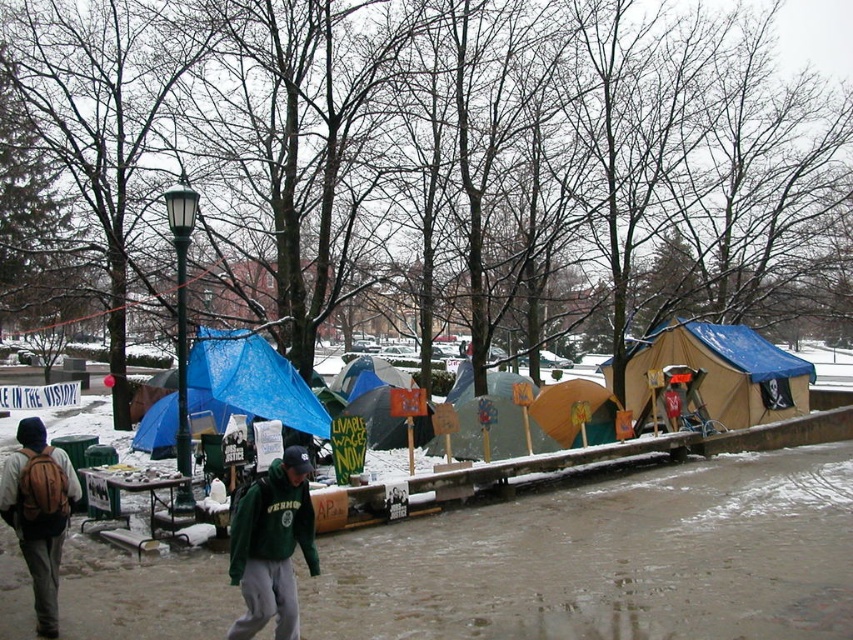
Question: Does green fleece jacket at center appear over yellow fabric tent at center?

Choices:
 (A) no
 (B) yes

Answer: (B)

Question: Based on their relative distances, which object is nearer to the yellow fabric tent at center?

Choices:
 (A) matte brown backpack at lower left
 (B) blue tarp at center
 (C) blue tarp tent at center

Answer: (B)

Question: Considering the real-world distances, which object is farthest from the yellow fabric tent at center?

Choices:
 (A) matte brown backpack at lower left
 (B) blue tarp at center
 (C) blue tarp tent at center

Answer: (A)

Question: Is tan canvas tent at center-right behind blue tarp at center?

Choices:
 (A) yes
 (B) no

Answer: (A)

Question: Can you confirm if yellow fabric tent at center is bigger than blue tarp tent at center?

Choices:
 (A) no
 (B) yes

Answer: (A)

Question: Among these points, which one is nearest to the camera?

Choices:
 (A) (401, 380)
 (B) (173, 445)
 (C) (595, 403)
 (D) (273, 586)

Answer: (D)